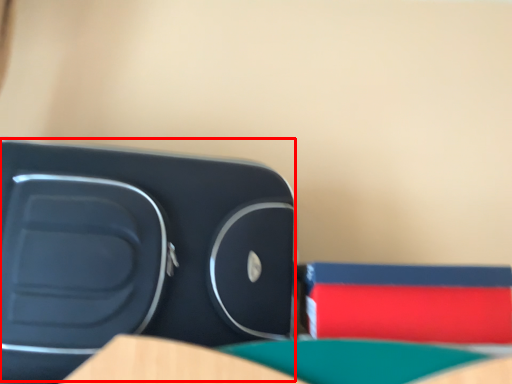
Question: In this image, where is turquoise (annotated by the red box) located relative to paperback book?

Choices:
 (A) left
 (B) right

Answer: (A)